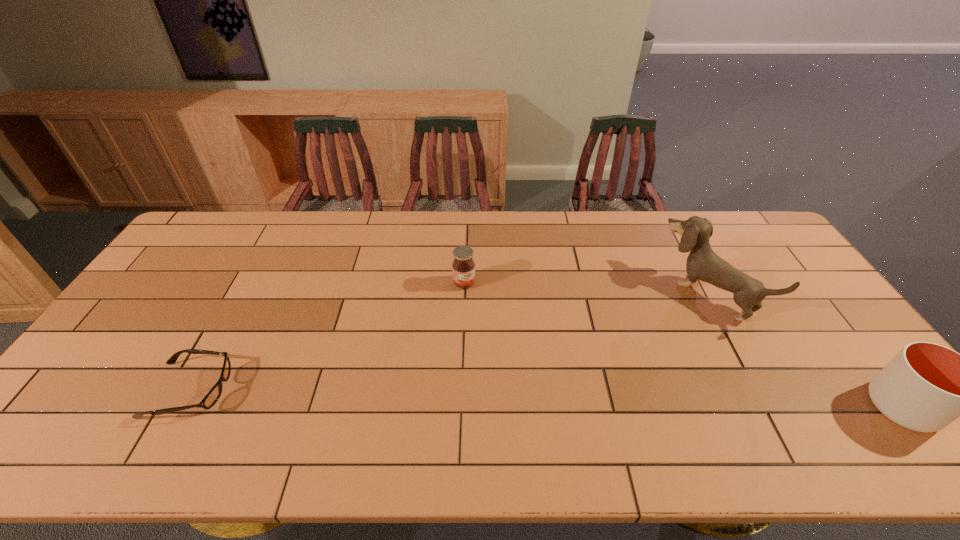
In the image, there is a desktop. What are the coordinates of `vacant space at the far edge` in the screenshot? It's located at (418, 237).

Locate an element on the screen. This screenshot has height=540, width=960. free space at the near edge of the desktop is located at coordinates (229, 410).

Where is `vacant space at the left edge of the desktop`? This screenshot has width=960, height=540. vacant space at the left edge of the desktop is located at coordinates (161, 334).

The image size is (960, 540). What are the coordinates of `free space at the right edge of the desktop` in the screenshot? It's located at (829, 329).

Where is `blank space at the far left corner of the desktop`? This screenshot has height=540, width=960. blank space at the far left corner of the desktop is located at coordinates (210, 242).

Locate an element on the screen. The image size is (960, 540). vacant area at the far right corner is located at coordinates (741, 239).

This screenshot has width=960, height=540. Find the location of `vacant region between the spectacles and the third shortest object`. vacant region between the spectacles and the third shortest object is located at coordinates (546, 398).

I want to click on free space between the leftmost object and the third object from left to right, so click(x=448, y=341).

Where is `vacant area between the cup and the shortest object`? This screenshot has width=960, height=540. vacant area between the cup and the shortest object is located at coordinates point(546,398).

Find the location of a particular element. This screenshot has width=960, height=540. vacant area that lies between the puppy and the shortest object is located at coordinates (448, 341).